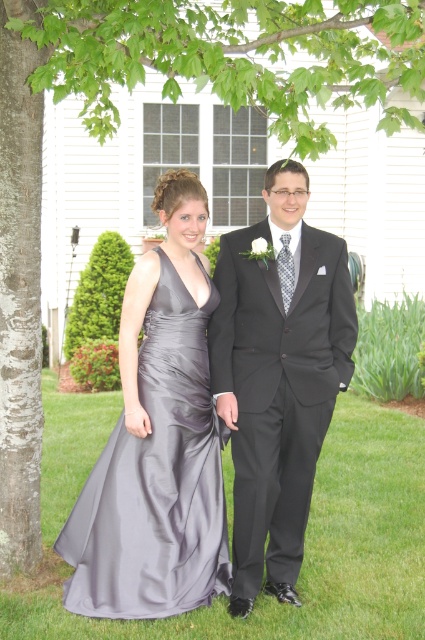
You are a photographer trying to capture a group photo of the silky gray dress at center and the shiny black suit at center. Since you want to ensure both are clearly visible, which one should you focus on first to avoid blurriness, considering their sizes?

The silky gray dress at center has a smaller size compared to shiny black suit at center, so you should focus on the smaller silky gray dress at center first to ensure its details are sharp before adjusting for the larger shiny black suit at center.